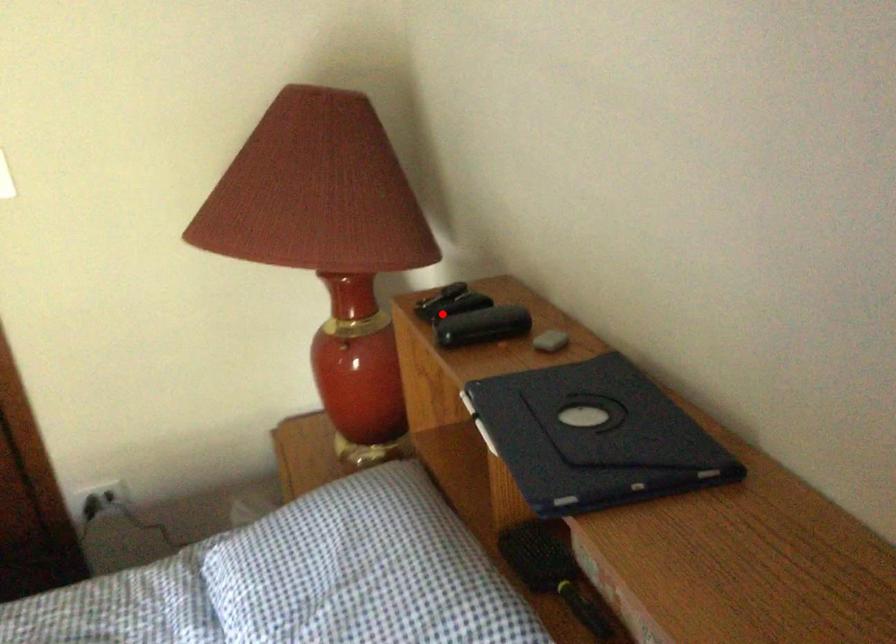
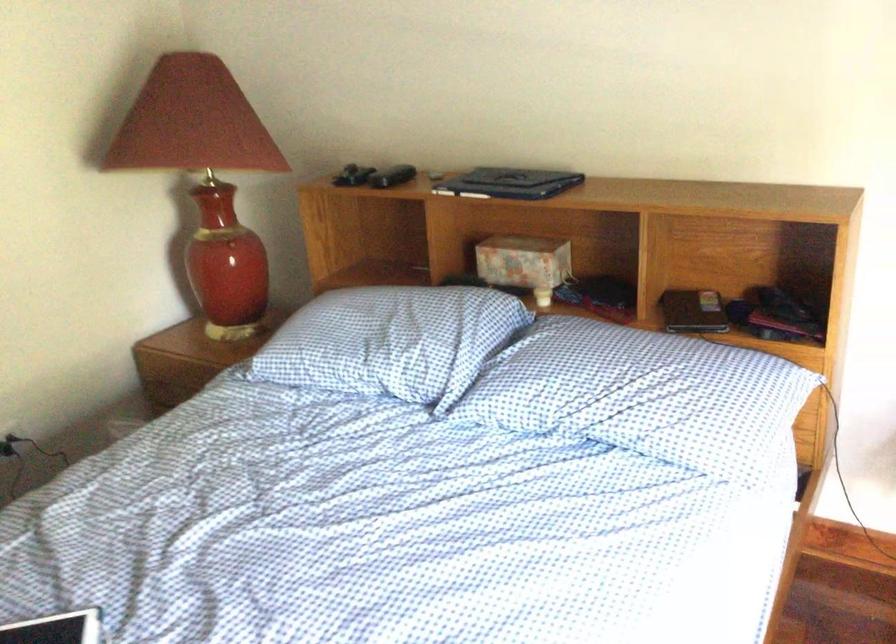
Question: I am providing you with two images of the same scene from different viewpoints. Image1 has a red point marked. In image2, the corresponding 3D location appears at what relative position? Reply with the corresponding letter.

Choices:
 (A) Closer
 (B) Farther

Answer: (B)